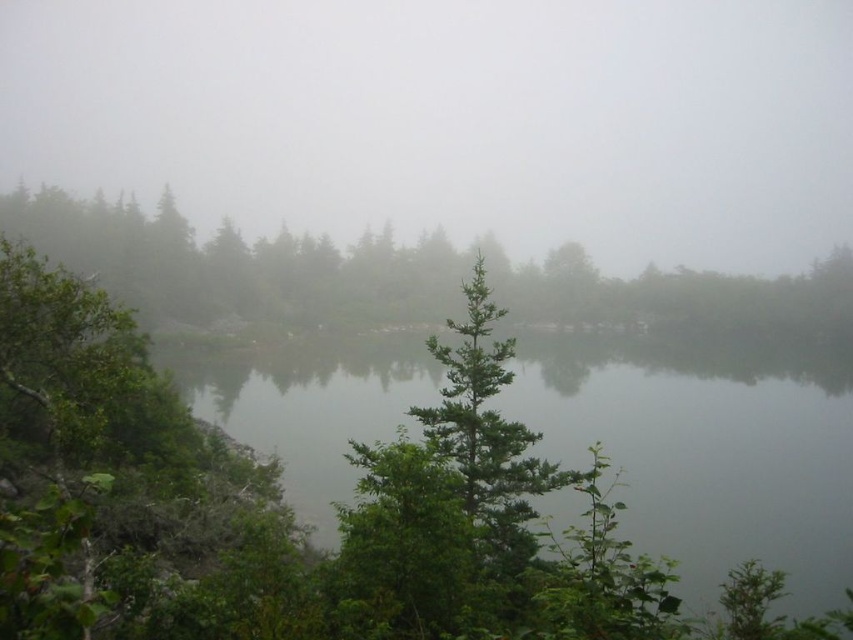
You are a painter standing in the serene landscape scene. You want to paint the foggy atmosphere at upper center and the green leafy water at center. Which object is higher in the painting?

The foggy atmosphere at upper center is taller than the green leafy water at center, so the foggy atmosphere at upper center is higher in the painting.

You are a hiker standing at the edge of the lake and see the foggy atmosphere at upper center and the green matte tree at upper left. Which object is farther away from you?

The foggy atmosphere at upper center is 381.24 meters away from the green matte tree at upper left, so the foggy atmosphere at upper center is farther away from you than the green matte tree at upper left.